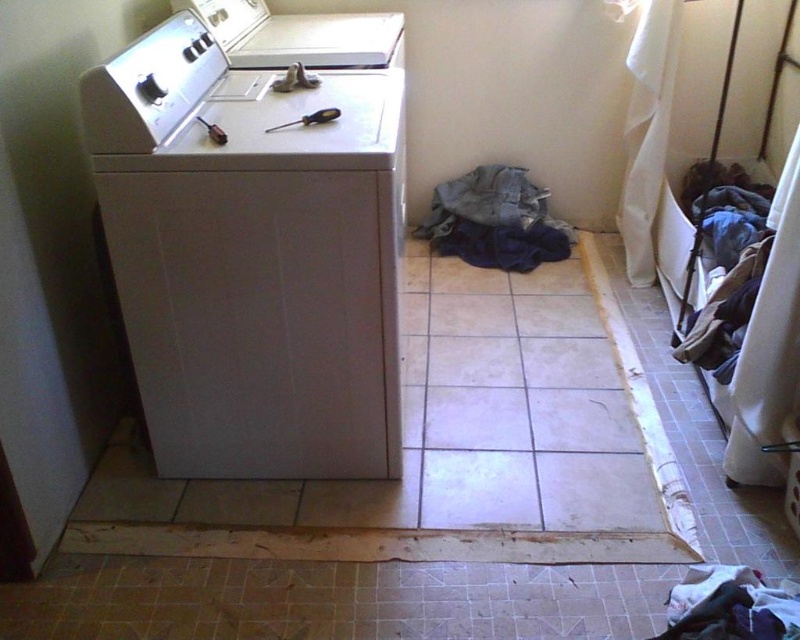
You are standing in the laundry room and need to place a faded denim jacket at lower center into the washing machine. Can you reach the washing machine from your current position without moving the jacket?

The faded denim jacket at lower center is located at point (494, 220). Since the washing machine is against the left wall and the jacket is at lower center, you can reach the washing machine without moving the jacket as they are not in the same location.

You need to place the faded denim jacket at lower center on top of the white plastic washing machine at left. Based on their sizes, will it fit without hanging over the edges?

The white plastic washing machine at left is wider than the faded denim jacket at lower center, so placing the jacket on top should fit without overhanging.

You are a home inspector assessing the laundry room. You see the white plastic washing machine at left and the fuzzy white laundry at lower right. Which object is taller?

The white plastic washing machine at left is much taller than the fuzzy white laundry at lower right.